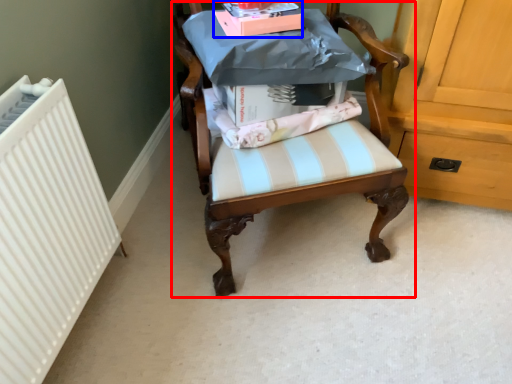
Question: Which object is further to the camera taking this photo, chair (highlighted by a red box) or book (highlighted by a blue box)?

Choices:
 (A) chair
 (B) book

Answer: (B)